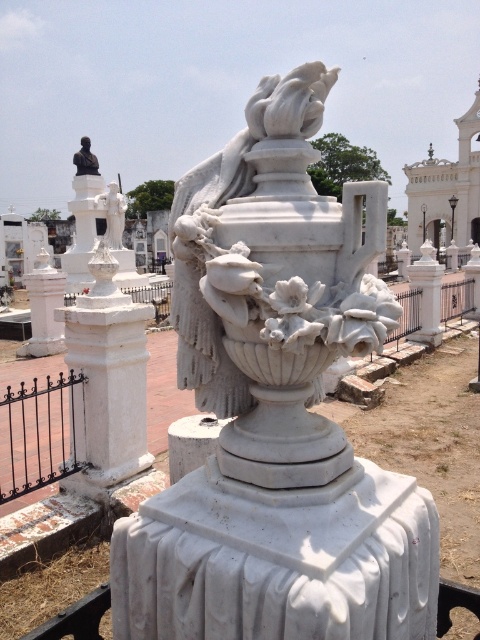
Is white marble post at left thinner than black wrought iron fence at left?

Yes, white marble post at left is thinner than black wrought iron fence at left.

This screenshot has width=480, height=640. What do you see at coordinates (108, 378) in the screenshot?
I see `white marble post at left` at bounding box center [108, 378].

Does point (132, 440) come closer to viewer compared to point (10, 442)?

Yes, point (132, 440) is closer to viewer.

This screenshot has width=480, height=640. Identify the location of white marble post at left. (108, 378).

In the scene shown: Can you confirm if matte white statue at upper left is shorter than matte black statue at upper left?

No.

How much distance is there between matte white statue at upper left and matte black statue at upper left?

matte white statue at upper left is 5.63 feet from matte black statue at upper left.

Who is more distant from viewer, (x=121, y=202) or (x=82, y=152)?

The point (x=82, y=152) is more distant.

Find the location of a particular element. matte white statue at upper left is located at coordinates (112, 214).

Can you confirm if white marble post at left is bigger than matte white statue at upper left?

Incorrect, white marble post at left is not larger than matte white statue at upper left.

Is white marble post at left wider than matte white statue at upper left?

No.

Who is more forward, [130,465] or [107,230]?

Point [130,465] is in front.

Find the location of a particular element. The height and width of the screenshot is (640, 480). white marble post at left is located at coordinates (108, 378).